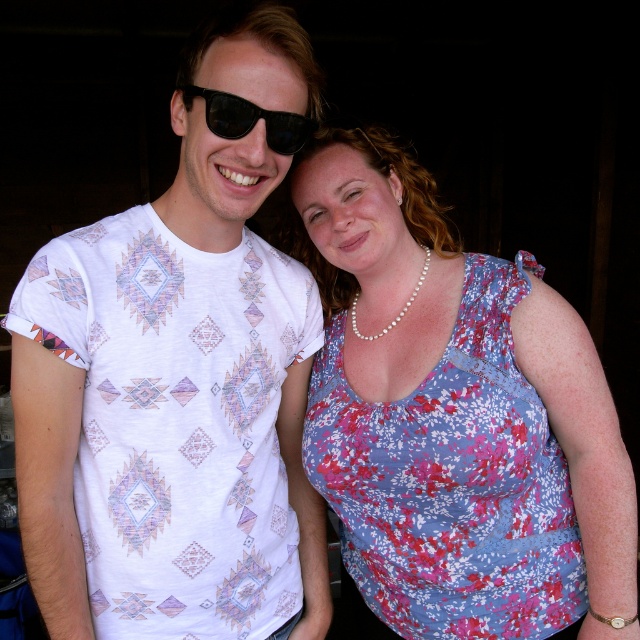
Who is shorter, floral print fabric dress at right or black reflective sunglasses at upper center?

With less height is black reflective sunglasses at upper center.

Does floral print fabric dress at right come in front of black reflective sunglasses at upper center?

That is False.

Between point (524, 378) and point (250, 106), which one is positioned in front?

Point (250, 106) is more forward.

Identify the location of floral print fabric dress at right. (452, 481).

Is white printed t-shirt at center closer to camera compared to floral print fabric dress at right?

Yes.

The height and width of the screenshot is (640, 640). What do you see at coordinates (177, 384) in the screenshot? I see `white printed t-shirt at center` at bounding box center [177, 384].

Does point (180, 452) come closer to viewer compared to point (376, 532)?

Yes, it is.

Where is `white printed t-shirt at center`? The width and height of the screenshot is (640, 640). white printed t-shirt at center is located at coordinates (177, 384).

Between white printed t-shirt at center and black reflective sunglasses at upper center, which one is positioned higher?

black reflective sunglasses at upper center is higher up.

Where is `white printed t-shirt at center`? This screenshot has width=640, height=640. white printed t-shirt at center is located at coordinates (177, 384).

Is point (104, 284) closer to viewer compared to point (282, 140)?

No, (104, 284) is behind (282, 140).

I want to click on white printed t-shirt at center, so click(177, 384).